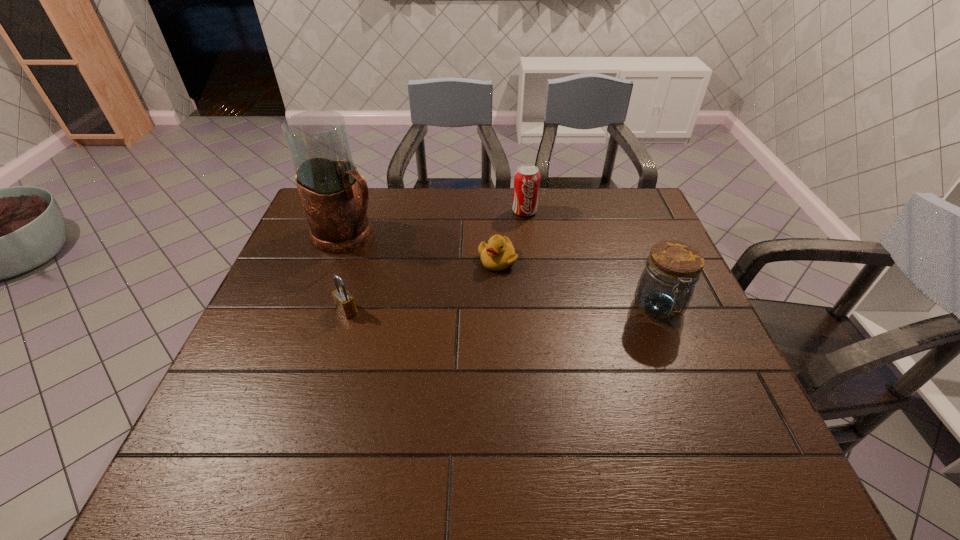
Identify the location of vacant area that lies between the pitcher and the third object from right to left. This screenshot has width=960, height=540. (422, 248).

At what (x,y) coordinates should I click in order to perform the action: click on vacant area that lies between the shortest object and the soda can. Please return your answer as a coordinate pair (x, y). This screenshot has width=960, height=540. Looking at the image, I should click on (511, 236).

Where is `unoccupied position between the fourth object from left to right and the pitcher`? This screenshot has width=960, height=540. unoccupied position between the fourth object from left to right and the pitcher is located at coordinates (436, 223).

This screenshot has width=960, height=540. I want to click on empty space between the jar and the third tallest object, so click(591, 260).

This screenshot has height=540, width=960. What are the coordinates of `free spot between the soda can and the padlock` in the screenshot? It's located at (436, 261).

Identify the location of free space between the shortest object and the tallest object. The width and height of the screenshot is (960, 540). (422, 248).

Locate an element on the screen. This screenshot has width=960, height=540. vacant space that is in between the shortest object and the padlock is located at coordinates (422, 286).

Locate an element on the screen. The height and width of the screenshot is (540, 960). unoccupied position between the rightmost object and the fourth tallest object is located at coordinates click(503, 309).

This screenshot has width=960, height=540. I want to click on free space that is in between the pitcher and the third tallest object, so click(x=436, y=223).

At what (x,y) coordinates should I click in order to perform the action: click on object that is the second closest to the tallest object. Please return your answer as a coordinate pair (x, y). This screenshot has width=960, height=540. Looking at the image, I should click on (498, 254).